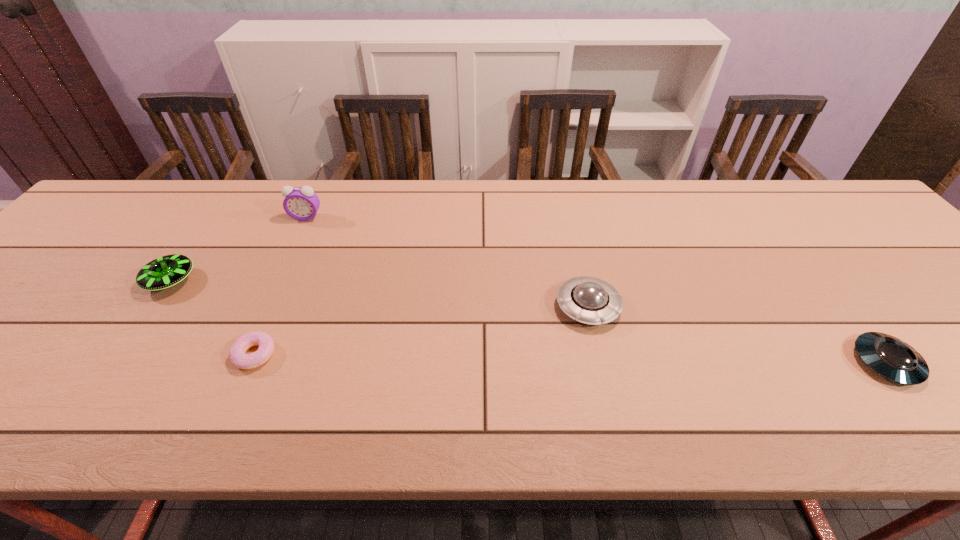
I want to click on vacant point located on the left of the fourth tallest object, so click(704, 362).

I want to click on vacant space located on the left of the shortest object, so click(47, 355).

Where is `object present at the far edge`? This screenshot has width=960, height=540. object present at the far edge is located at coordinates (301, 203).

This screenshot has height=540, width=960. Find the location of `vacant space at the far edge of the desktop`. vacant space at the far edge of the desktop is located at coordinates (440, 208).

Find the location of a particular element. The image size is (960, 540). free space at the near edge of the desktop is located at coordinates (420, 418).

This screenshot has width=960, height=540. In order to click on free space at the left edge in this screenshot , I will do `click(80, 261)`.

The image size is (960, 540). In the image, there is a desktop. Find the location of `vacant area at the right edge`. vacant area at the right edge is located at coordinates (920, 276).

In the image, there is a desktop. Identify the location of vacant space at the far left corner. (128, 205).

Image resolution: width=960 pixels, height=540 pixels. What are the coordinates of `vacant space at the far right corner of the desktop` in the screenshot? It's located at (828, 198).

This screenshot has height=540, width=960. What are the coordinates of `vacant area that lies between the tallest object and the fourth object from left to right` in the screenshot? It's located at (447, 262).